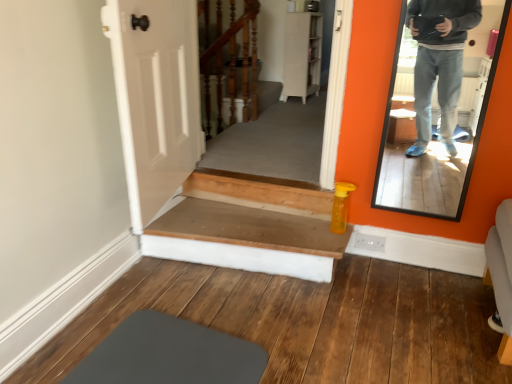
The height and width of the screenshot is (384, 512). Describe the element at coordinates (228, 61) in the screenshot. I see `wooden stairwell at center` at that location.

This screenshot has height=384, width=512. What are the coordinates of `matte black mirror at right` in the screenshot? It's located at (431, 112).

This screenshot has width=512, height=384. I want to click on wooden stairwell at center, so click(228, 61).

Between wooden stairwell at center and matte black mirror at right, which one has more height?

With more height is wooden stairwell at center.

At what (x,y) coordinates should I click in order to perform the action: click on mirror that is below the wooden stairwell at center (from the image's perspective). Please return your answer as a coordinate pair (x, y). The width and height of the screenshot is (512, 384). Looking at the image, I should click on (431, 112).

In terms of size, does wooden stairwell at center appear bigger or smaller than matte black mirror at right?

Clearly, wooden stairwell at center is larger in size than matte black mirror at right.

Is wooden stairs at center positioned far away from wooden stairwell at center?

That's right, there is a large distance between wooden stairs at center and wooden stairwell at center.

Based on their sizes in the image, would you say wooden stairs at center is bigger or smaller than wooden stairwell at center?

Clearly, wooden stairs at center is smaller in size than wooden stairwell at center.

From a real-world perspective, is wooden stairs at center positioned above or below wooden stairwell at center?

In terms of real-world spatial position, wooden stairs at center is below wooden stairwell at center.

Is the depth of wooden stairs at center less than that of wooden stairwell at center?

Yes, it is in front of wooden stairwell at center.

What are the coordinates of `stairs located below the matte black mirror at right (from the image's perspective)` in the screenshot? It's located at (249, 226).

Is matte black mirror at right looking in the opposite direction of wooden stairs at center?

matte black mirror at right is not turned away from wooden stairs at center.

Based on the photo, from a real-world perspective, is matte black mirror at right physically located above or below wooden stairs at center?

matte black mirror at right is situated higher than wooden stairs at center in the real world.

Which of these two, matte black mirror at right or wooden stairs at center, is thinner?

With smaller width is matte black mirror at right.

In terms of height, does wooden stairwell at center look taller or shorter compared to wooden stairs at center?

In the image, wooden stairwell at center appears to be taller than wooden stairs at center.

Is wooden stairwell at center not within wooden stairs at center?

Yes.

Considering the positions of points (210, 110) and (266, 199), is point (210, 110) farther from camera compared to point (266, 199)?

That is True.

Between wooden stairwell at center and wooden stairs at center, which one has larger size?

With larger size is wooden stairwell at center.

Which is more to the left, wooden stairs at center or matte black mirror at right?

wooden stairs at center.

What are the coordinates of `mirror positioned vertically above the wooden stairs at center (from a real-world perspective)` in the screenshot? It's located at (431, 112).

Between wooden stairs at center and matte black mirror at right, which one has larger size?

With larger size is wooden stairs at center.

In terms of height, does wooden stairs at center look taller or shorter compared to matte black mirror at right?

wooden stairs at center is shorter than matte black mirror at right.

Which of these two, matte black mirror at right or wooden stairwell at center, stands taller?

wooden stairwell at center is taller.

In the image, is matte black mirror at right on the left side or the right side of wooden stairwell at center?

Based on their positions, matte black mirror at right is located to the right of wooden stairwell at center.

Which object is further away from the camera taking this photo, matte black mirror at right or wooden stairwell at center?

wooden stairwell at center is further away from the camera.

I want to click on stairwell behind the matte black mirror at right, so click(228, 61).

At what (x,y) coordinates should I click in order to perform the action: click on stairs below the wooden stairwell at center (from the image's perspective). Please return your answer as a coordinate pair (x, y). This screenshot has height=384, width=512. Looking at the image, I should click on (249, 226).

Based on their spatial positions, is wooden stairwell at center or wooden stairs at center further from matte black mirror at right?

wooden stairwell at center is positioned further to the anchor matte black mirror at right.

Which object lies nearer to the anchor point wooden stairs at center, wooden stairwell at center or matte black mirror at right?

Based on the image, matte black mirror at right appears to be nearer to wooden stairs at center.

Estimate the real-world distances between objects in this image. Which object is further from wooden stairwell at center, wooden stairs at center or matte black mirror at right?

matte black mirror at right.

Estimate the real-world distances between objects in this image. Which object is further from wooden stairs at center, matte black mirror at right or wooden stairwell at center?

wooden stairwell at center is further to wooden stairs at center.

Considering their positions, is wooden stairs at center positioned further to matte black mirror at right than wooden stairwell at center?

The object further to matte black mirror at right is wooden stairwell at center.

Which object lies nearer to the anchor point wooden stairwell at center, matte black mirror at right or wooden stairs at center?

Based on the image, wooden stairs at center appears to be nearer to wooden stairwell at center.

Where is `stairs located between matte black mirror at right and wooden stairwell at center in the depth direction`? stairs located between matte black mirror at right and wooden stairwell at center in the depth direction is located at coordinates (249, 226).